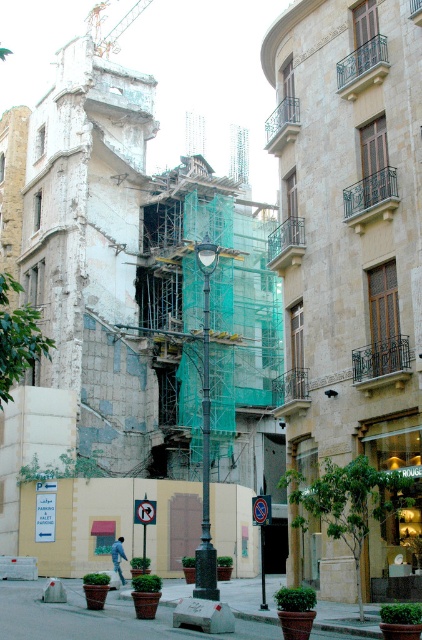
Question: Does green painted metal pole at center appear on the left side of denim jacket at lower left?

Choices:
 (A) no
 (B) yes

Answer: (A)

Question: Which point is farther to the camera?

Choices:
 (A) green painted metal pole at center
 (B) denim jacket at lower left

Answer: (B)

Question: Does green painted metal pole at center have a larger size compared to denim jacket at lower left?

Choices:
 (A) yes
 (B) no

Answer: (A)

Question: From the image, what is the correct spatial relationship of green painted metal pole at center in relation to denim jacket at lower left?

Choices:
 (A) left
 (B) right

Answer: (B)